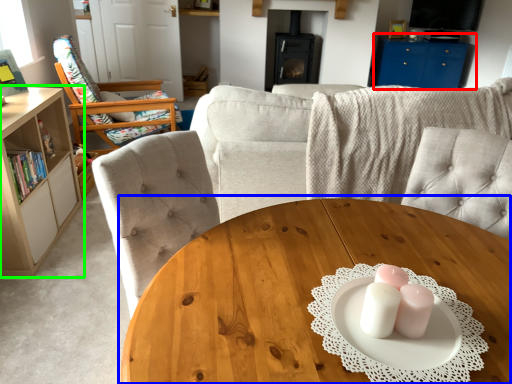
Question: Which is farther away from entertainment center (highlighted by a red box)? coffee table (highlighted by a blue box) or cabinetry (highlighted by a green box)?

Choices:
 (A) coffee table
 (B) cabinetry

Answer: (A)